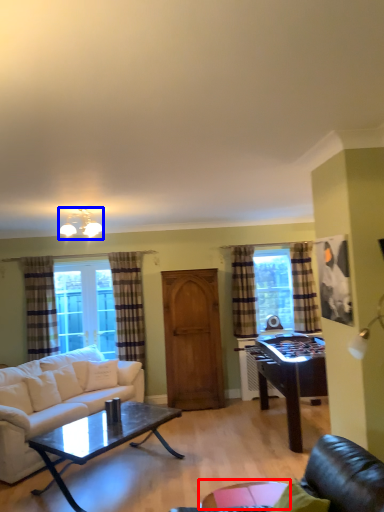
Question: Which object appears closest to the camera in this image, glass table (highlighted by a red box) or light fixture (highlighted by a blue box)?

Choices:
 (A) glass table
 (B) light fixture

Answer: (A)